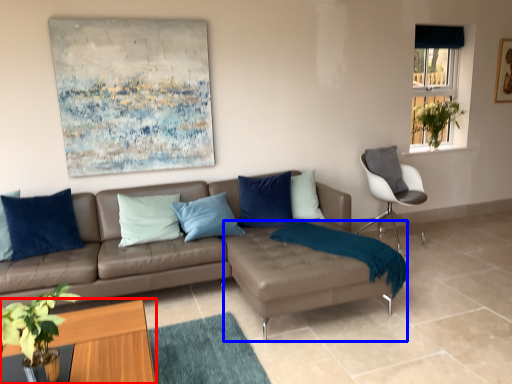
Question: Which object is further to the camera taking this photo, coffee table (highlighted by a red box) or footrest (highlighted by a blue box)?

Choices:
 (A) coffee table
 (B) footrest

Answer: (B)